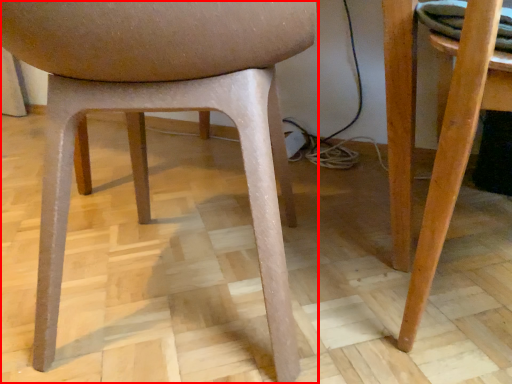
Question: From the image, what is the correct spatial relationship of chair (annotated by the red box) in relation to table?

Choices:
 (A) right
 (B) left

Answer: (B)